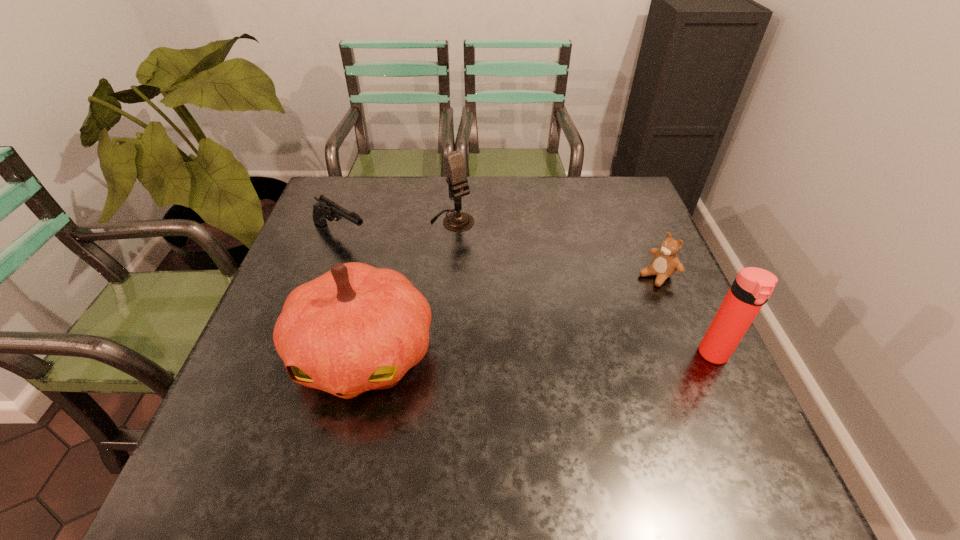
Find the location of a particular element. This screenshot has height=540, width=960. free space on the desktop that is between the pumpkin and the thermos bottle and is positioned on the front-facing side of the third farthest object is located at coordinates (540, 354).

Image resolution: width=960 pixels, height=540 pixels. What are the coordinates of `vacant space on the desktop that is between the pumpkin and the thermos bottle and is positioned on the front-facing side of the microphone` in the screenshot? It's located at (589, 355).

Where is `vacant space on the desktop that is between the pumpkin and the thermos bottle and is positioned at the end of the barrel of the gun`? This screenshot has width=960, height=540. vacant space on the desktop that is between the pumpkin and the thermos bottle and is positioned at the end of the barrel of the gun is located at coordinates (542, 354).